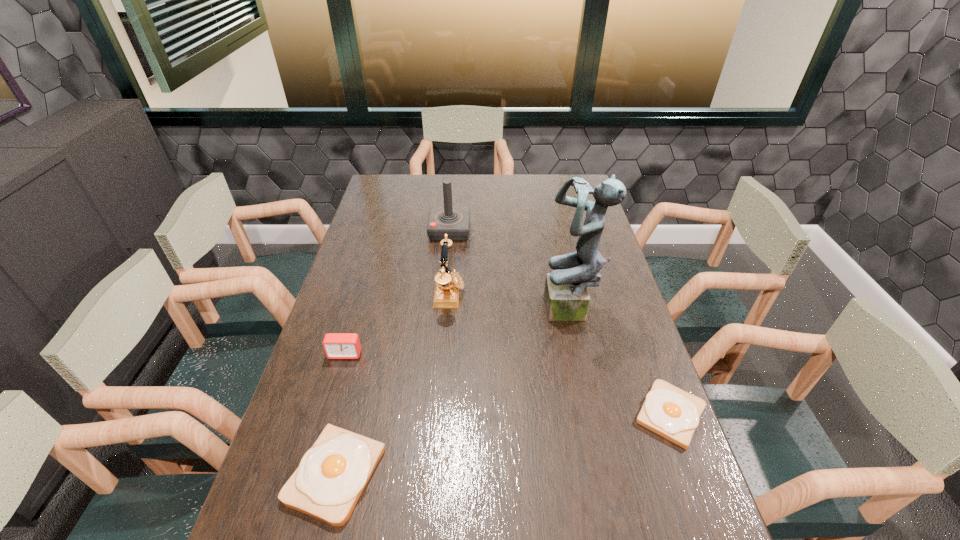
At what (x,y) coordinates should I click in order to perform the action: click on the fifth object from left to right. Please return your answer as a coordinate pair (x, y). Looking at the image, I should click on (566, 296).

The image size is (960, 540). What are the coordinates of `vacant space located on the back of the second shortest object` in the screenshot? It's located at (375, 313).

Find the location of a particular element. This screenshot has width=960, height=540. vacant space situated on the left of the rightmost object is located at coordinates (577, 414).

Identify the location of vacant area situated 0.220m on the dial of the telephone. This screenshot has height=540, width=960. (532, 293).

You are a GUI agent. You are given a task and a screenshot of the screen. Output one action in this format:
    pyautogui.click(x=<x>, y=<y>)
    Task: Click on the vacant space located 0.070m on the front-facing side of the alarm clock
    
    Given the screenshot: What is the action you would take?
    pyautogui.click(x=337, y=381)

You are a GUI agent. You are given a task and a screenshot of the screen. Output one action in this format:
    pyautogui.click(x=<x>, y=<y>)
    Task: Click on the vacant point located 0.130m on the rectangular base of the joystick
    Image resolution: width=960 pixels, height=540 pixels.
    Given the screenshot: What is the action you would take?
    pyautogui.click(x=503, y=230)

I want to click on free space located on the face of the sculpture, so click(444, 311).

Locate an element on the screen. This screenshot has height=540, width=960. vacant area situated on the face of the sculpture is located at coordinates (475, 311).

The height and width of the screenshot is (540, 960). What are the coordinates of `free region located 0.400m on the face of the sculpture` in the screenshot? It's located at (414, 311).

Where is `object located at the near edge`? The image size is (960, 540). object located at the near edge is located at coordinates (332, 474).